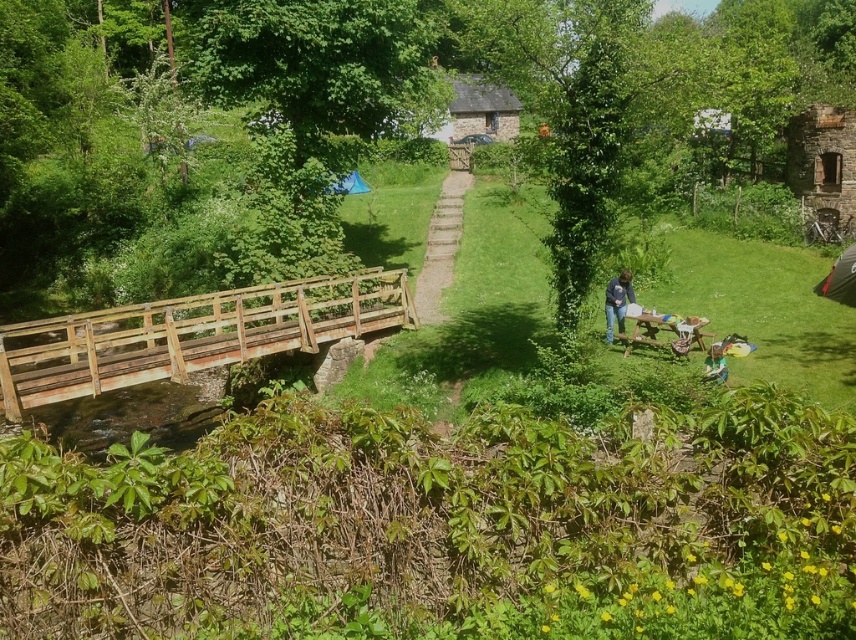
You are standing at the point with coordinates point [617,324] and want to walk towards the point with coordinates point [446,230]. According to the scene, will you be moving towards the foreground or background?

Since point [446,230] is behind point [617,324], moving towards it means you are walking towards the background.

You are standing on the wooden stairs at center and want to place your blue denim jeans at center in a spot where they won t get stepped on. Considering their sizes, where should you place them?

Since the wooden stairs at center is bigger than the blue denim jeans at center, you can place the blue denim jeans at center on the wooden stairs at center without worrying about them getting stepped on, as they will fit comfortably.